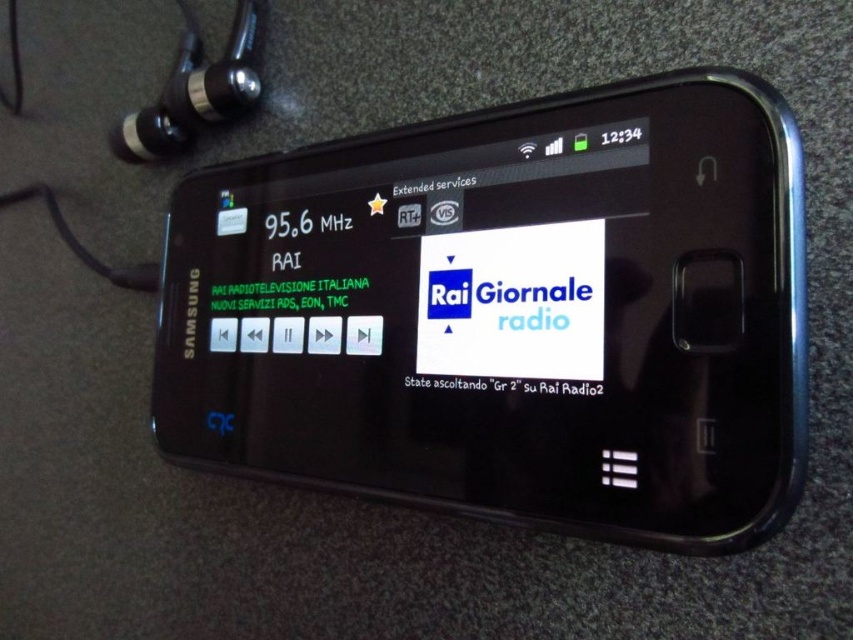
Looking at this image, is black plastic smartphone at center to the left of black metallic earphone at upper left from the viewer's perspective?

Incorrect, black plastic smartphone at center is not on the left side of black metallic earphone at upper left.

Locate an element on the screen. This screenshot has width=853, height=640. black plastic smartphone at center is located at coordinates (509, 314).